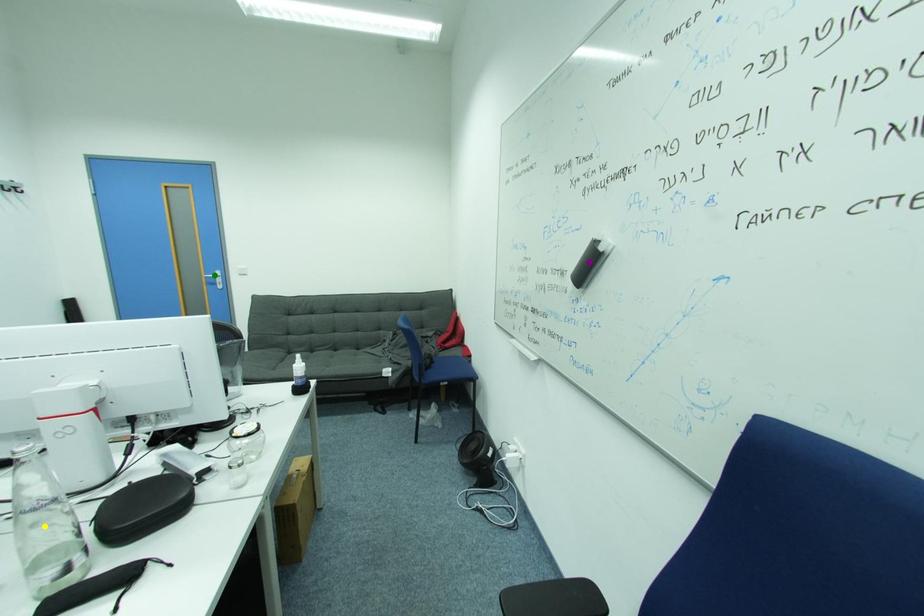
Order these from nearest to farthest:
yellow point | green point | purple point

green point
purple point
yellow point